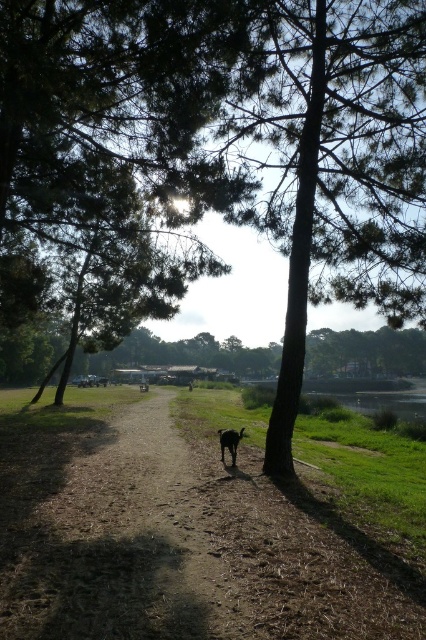
You are standing at the point marked by the coordinates point (167,538) in the image. What is the terrain like under your feet?

The terrain under your feet at point (167,538) is brown dirt path at center, which is a dirt path.

You are a hiker who wants to take a photo of the black fur dog at center while standing on the brown dirt path at center. Since the path is wider than the dog, where should you position yourself to ensure the dog fits entirely in the photo frame?

The brown dirt path at center is larger than the black fur dog at center, so you should position yourself on the brown dirt path at center such that the dog is centered within the frame, allowing enough space on both sides since the path is wider.